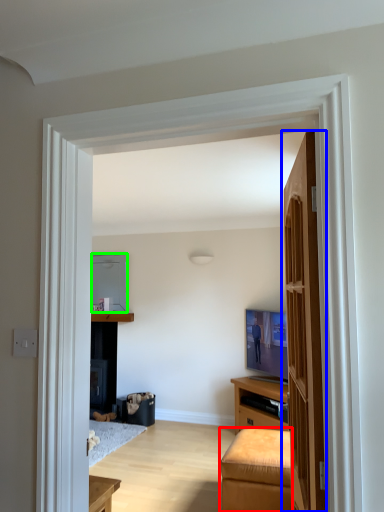
Question: Based on their relative distances, which object is nearer to furniture (highlighted by a red box)? Choose from door (highlighted by a blue box) and appliance (highlighted by a green box).

Choices:
 (A) door
 (B) appliance

Answer: (A)